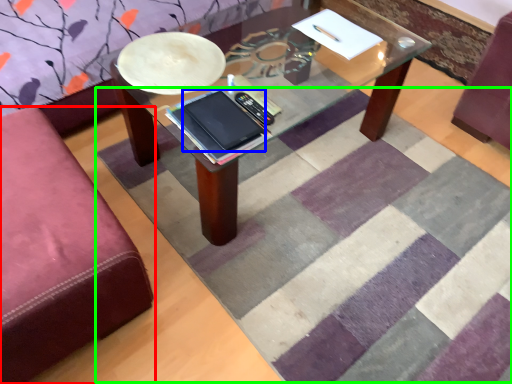
Question: Which object is positioned closest to studio couch (highlighted by a red box)? Select from tablet computer (highlighted by a blue box) and mat (highlighted by a green box).

Choices:
 (A) tablet computer
 (B) mat

Answer: (A)